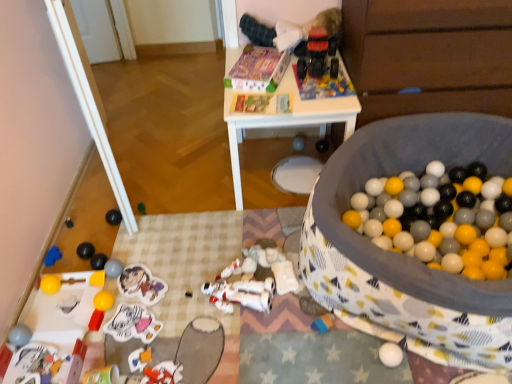
In order to click on free space above white plastic table at upper center (from a real-world perspective) in this screenshot , I will do `click(282, 81)`.